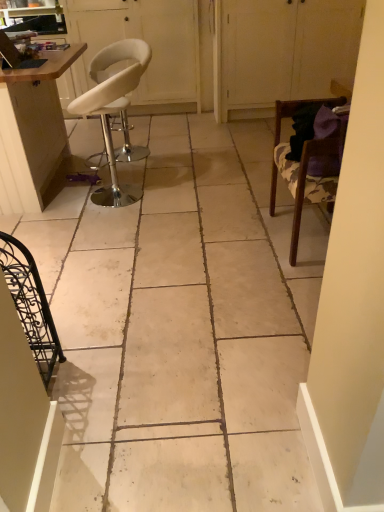
Where is `vacant region to the right of white leather stool at left, which ranks as the third chair in front-to-back order`? The image size is (384, 512). vacant region to the right of white leather stool at left, which ranks as the third chair in front-to-back order is located at coordinates point(183,193).